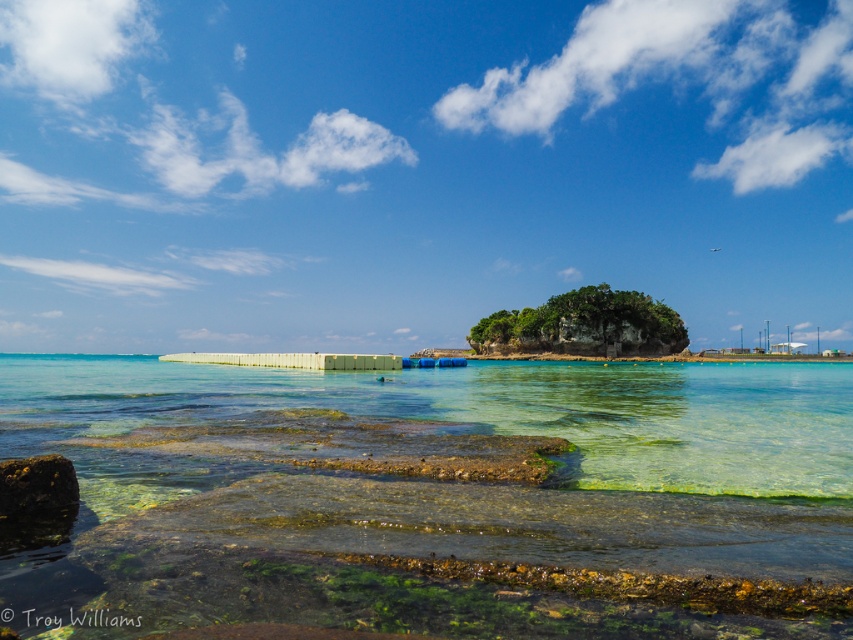
You are standing on the green mossy rock at center and want to jump into the water. Is the clear glass water at center directly below you?

Yes, the clear glass water at center is directly below the green mossy rock at center, so you can jump into it safely.